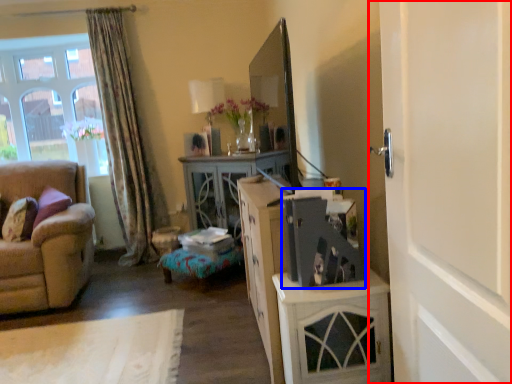
Question: Which object appears closest to the camera in this image, door (highlighted by a red box) or appliance (highlighted by a blue box)?

Choices:
 (A) door
 (B) appliance

Answer: (A)